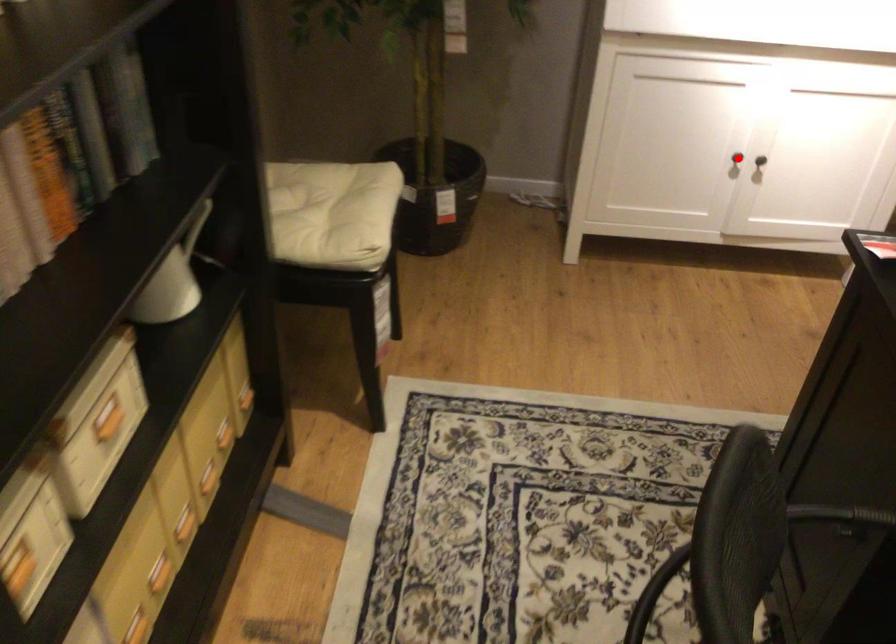
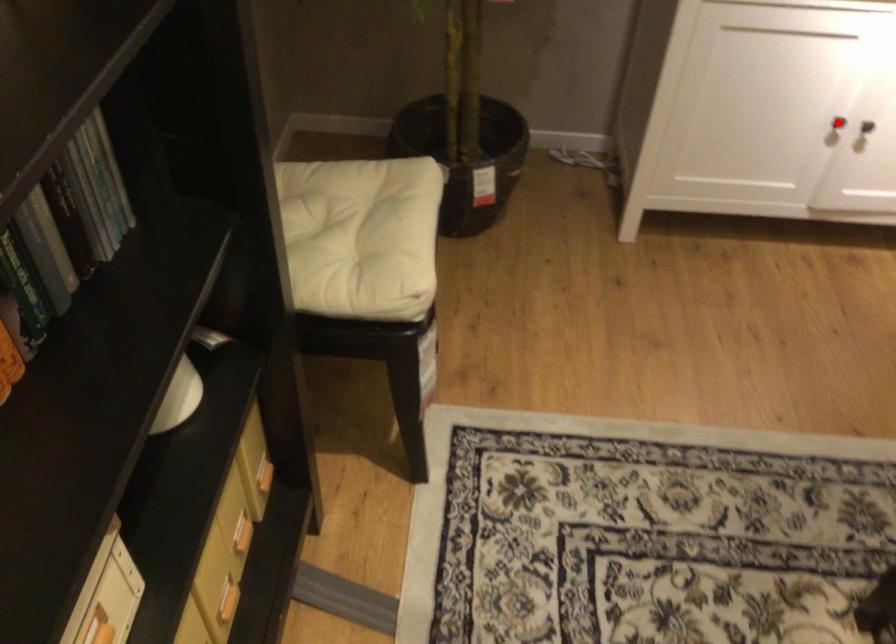
I am providing you with two images of the same scene from different viewpoints. A red point is marked on the first image and another point is marked on the second image. Are the points marked in image1 and image2 representing the same 3D position?

Yes